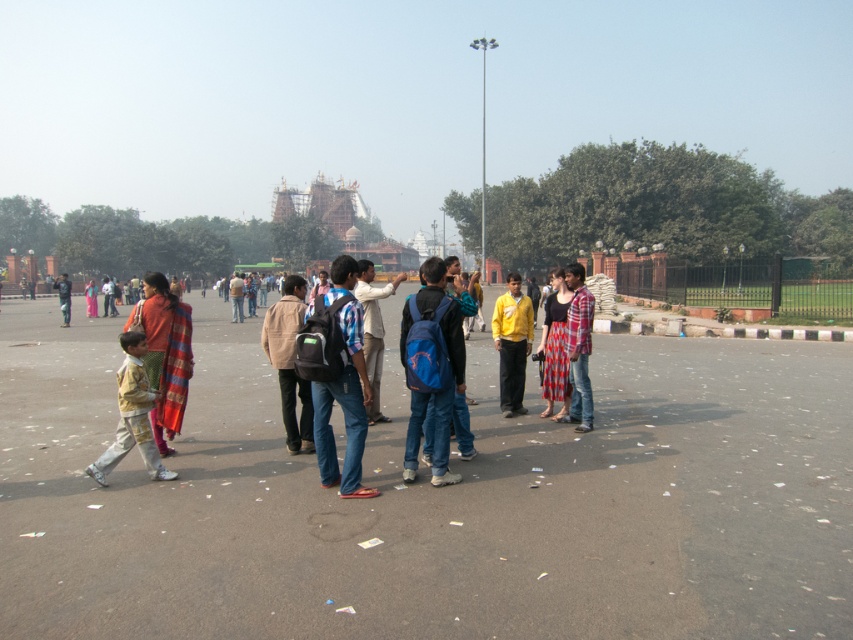
Question: Does light yellow shirt at lower left appear under dark blue jeans at center?

Choices:
 (A) no
 (B) yes

Answer: (B)

Question: Which point is closer to the camera?

Choices:
 (A) plaid shirt at center
 (B) red plaid skirt at center

Answer: (A)

Question: Which is farther from the denim jeans at center?

Choices:
 (A) yellow matte shirt at center
 (B) dark blue jeans at center
 (C) blue fabric backpack at center
 (D) matte red fabric at left

Answer: (B)

Question: Can you confirm if denim jeans at center is positioned below light yellow shirt at lower left?

Choices:
 (A) no
 (B) yes

Answer: (A)

Question: Does matte red fabric at left have a larger size compared to yellow matte shirt at center?

Choices:
 (A) yes
 (B) no

Answer: (A)

Question: Which object is closer to the camera taking this photo?

Choices:
 (A) brown leather jacket at center
 (B) light yellow shirt at lower left

Answer: (B)